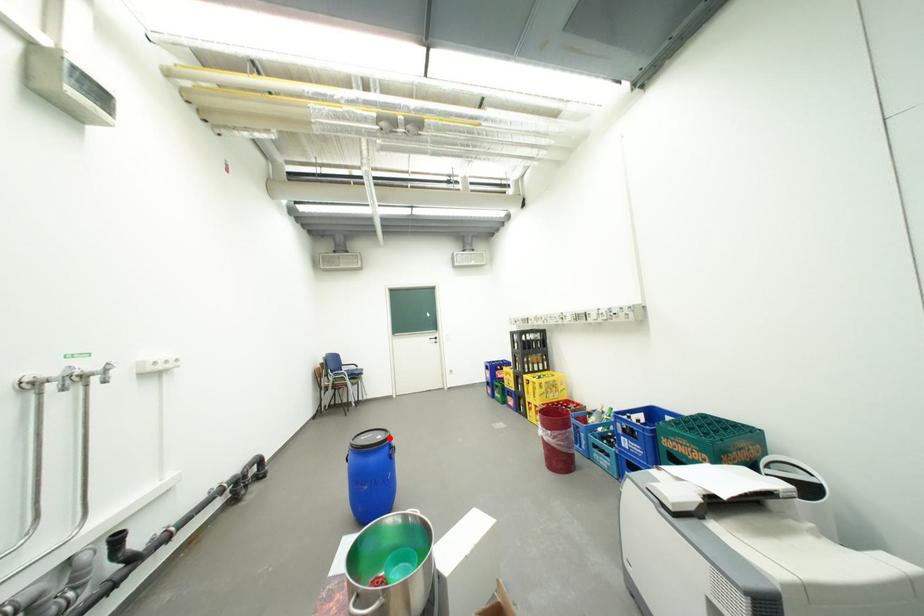
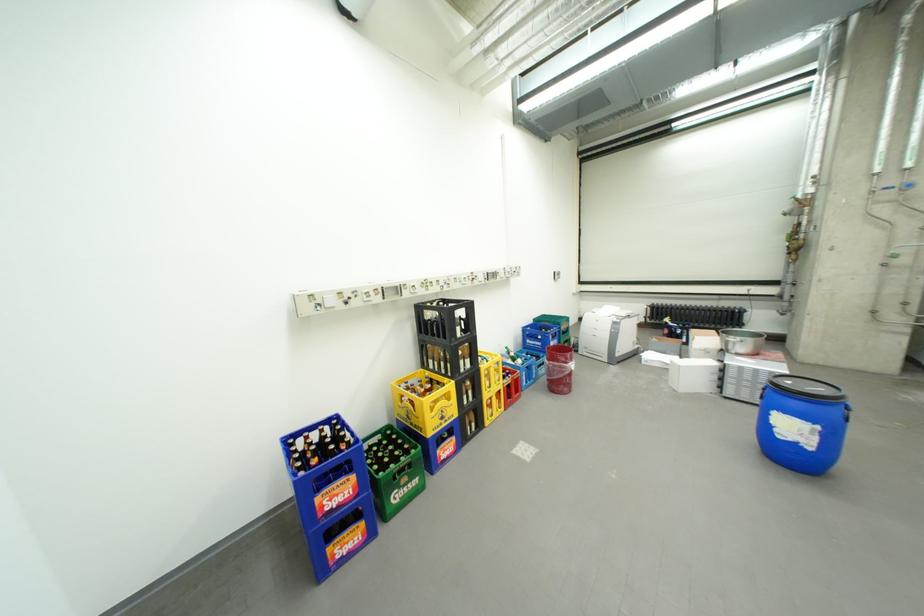
Question: I am providing you with two images of the same scene from different viewpoints. Given a red point in image1, look at the same physical point in image2. Is it:

Choices:
 (A) Closer to the viewpoint
 (B) Farther from the viewpoint

Answer: (B)